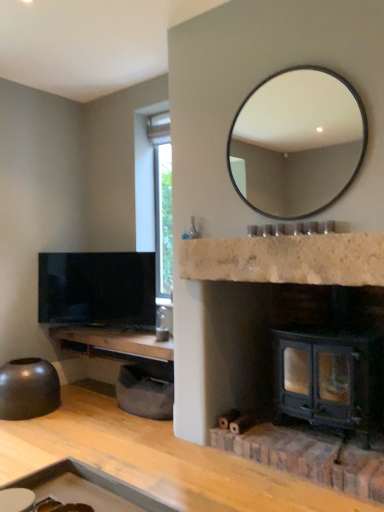
Describe the element at coordinates (329, 380) in the screenshot. I see `dark green metal wood burning stove at lower right` at that location.

Image resolution: width=384 pixels, height=512 pixels. In order to click on white marble fireplace at center, the second counter top from the bottom in this screenshot , I will do `click(287, 259)`.

Find the location of a particular element. woodenmaterial/texturecounter top at left, acting as the 1th counter top starting from the back is located at coordinates (113, 343).

Identify the location of matte black bowl at lower left. This screenshot has height=512, width=384. (28, 389).

The height and width of the screenshot is (512, 384). Identify the location of dark green metal wood burning stove at lower right. (329, 380).

Which object is further away from the camera taking this photo, dark green metal wood burning stove at lower right or white marble fireplace at center, the second counter top from the bottom?

dark green metal wood burning stove at lower right is more distant.

Is dark green metal wood burning stove at lower right facing towards white marble fireplace at center, the first counter top in the top-to-bottom sequence?

No.

From the picture: Which is more to the left, dark green metal wood burning stove at lower right or white marble fireplace at center, the second counter top from the bottom?

white marble fireplace at center, the second counter top from the bottom, is more to the left.

In the scene shown: Is dark green metal wood burning stove at lower right beside white marble fireplace at center, marked as the 2th counter top in a back-to-front arrangement?

There is a gap between dark green metal wood burning stove at lower right and white marble fireplace at center, marked as the 2th counter top in a back-to-front arrangement.

From a real-world perspective, relative to white marble fireplace at center, the first counter top in the top-to-bottom sequence, is matte black tv at left vertically above or below?

Clearly, from a real-world perspective, matte black tv at left is below white marble fireplace at center, the first counter top in the top-to-bottom sequence.

Is matte black tv at left at the left side of white marble fireplace at center, positioned as the 2th counter top in left-to-right order?

Yes.

Can you confirm if matte black tv at left is bigger than white marble fireplace at center, the second counter top from the bottom?

Indeed, matte black tv at left has a larger size compared to white marble fireplace at center, the second counter top from the bottom.

Choose the correct answer: Is matte black tv at left inside white marble fireplace at center, the first counter top in the top-to-bottom sequence, or outside it?

matte black tv at left cannot be found inside white marble fireplace at center, the first counter top in the top-to-bottom sequence.

Is matte black mirror at upper center not within dark green metal wood burning stove at lower right?

Yes, matte black mirror at upper center is not within dark green metal wood burning stove at lower right.

Is matte black mirror at upper center oriented away from dark green metal wood burning stove at lower right?

No, matte black mirror at upper center is not facing away from dark green metal wood burning stove at lower right.

In order to click on mirror in front of the dark green metal wood burning stove at lower right in this screenshot , I will do `click(297, 143)`.

From the image's perspective, is matte black mirror at upper center located above or below dark green metal wood burning stove at lower right?

→ From the image's perspective, matte black mirror at upper center appears above dark green metal wood burning stove at lower right.

Is white marble fireplace at center, the first counter top in the top-to-bottom sequence, next to matte black bowl at lower left?

white marble fireplace at center, the first counter top in the top-to-bottom sequence, and matte black bowl at lower left are clearly separated.

There is a matte black bowl at lower left. Identify the location of the 2nd counter top above it (from the image's perspective). This screenshot has width=384, height=512. (287, 259).

Considering the relative sizes of white marble fireplace at center, the first counter top in the top-to-bottom sequence, and matte black bowl at lower left in the image provided, is white marble fireplace at center, the first counter top in the top-to-bottom sequence, bigger than matte black bowl at lower left?

No, white marble fireplace at center, the first counter top in the top-to-bottom sequence, is not bigger than matte black bowl at lower left.

Is white marble fireplace at center, positioned as the 1th counter top in right-to-left order, shorter than matte black bowl at lower left?

Indeed, white marble fireplace at center, positioned as the 1th counter top in right-to-left order, has a lesser height compared to matte black bowl at lower left.

Between woodenmaterial/texturecounter top at left, the first counter top positioned from the bottom, and white marble fireplace at center, marked as the 2th counter top in a back-to-front arrangement, which one is positioned in front?

white marble fireplace at center, marked as the 2th counter top in a back-to-front arrangement, is in front.

Is woodenmaterial/texturecounter top at left, acting as the 1th counter top starting from the back, placed right next to white marble fireplace at center, arranged as the first counter top when viewed from the front?

woodenmaterial/texturecounter top at left, acting as the 1th counter top starting from the back, and white marble fireplace at center, arranged as the first counter top when viewed from the front, are clearly separated.

Is point (92, 337) less distant than point (248, 250)?

No.

From the picture: Measure the distance from woodenmaterial/texturecounter top at left, placed as the 2th counter top when sorted from front to back, to white marble fireplace at center, the second counter top from the bottom.

woodenmaterial/texturecounter top at left, placed as the 2th counter top when sorted from front to back, and white marble fireplace at center, the second counter top from the bottom, are 1.16 meters apart.

From a real-world perspective, relative to matte black tv at left, is white marble fireplace at center, the first counter top in the top-to-bottom sequence, vertically above or below?

white marble fireplace at center, the first counter top in the top-to-bottom sequence, is situated higher than matte black tv at left in the real world.

Is matte black tv at left at the back of white marble fireplace at center, arranged as the first counter top when viewed from the front?

No, white marble fireplace at center, arranged as the first counter top when viewed from the front, is not facing the opposite direction of matte black tv at left.

Considering the positions of points (242, 278) and (77, 285), is point (242, 278) farther from camera compared to point (77, 285)?

No, it is in front of (77, 285).

From the image's perspective, is white marble fireplace at center, the first counter top in the top-to-bottom sequence, below matte black tv at left?

Incorrect, from the image's perspective, white marble fireplace at center, the first counter top in the top-to-bottom sequence, is higher than matte black tv at left.

Is dark green metal wood burning stove at lower right aimed at woodenmaterial/texturecounter top at left, placed as the 2th counter top when sorted from front to back?

No, dark green metal wood burning stove at lower right is not oriented towards woodenmaterial/texturecounter top at left, placed as the 2th counter top when sorted from front to back.

Which is correct: dark green metal wood burning stove at lower right is inside woodenmaterial/texturecounter top at left, the first counter top from the left, or outside of it?

dark green metal wood burning stove at lower right is not enclosed by woodenmaterial/texturecounter top at left, the first counter top from the left.

In the image, is dark green metal wood burning stove at lower right positioned in front of or behind woodenmaterial/texturecounter top at left, placed as the 2th counter top when sorted from front to back?

Visually, dark green metal wood burning stove at lower right is located in front of woodenmaterial/texturecounter top at left, placed as the 2th counter top when sorted from front to back.

Identify the location of wood burning stove located underneath the white marble fireplace at center, the second counter top from the bottom (from a real-world perspective). (329, 380).

Where is `the 2nd counter top counting from the right side of the matte black tv at left`? This screenshot has height=512, width=384. the 2nd counter top counting from the right side of the matte black tv at left is located at coordinates (287, 259).

Estimate the real-world distances between objects in this image. Which object is further from matte black mirror at upper center, matte black bowl at lower left or white marble fireplace at center, arranged as the first counter top when viewed from the front?

Based on the image, matte black bowl at lower left appears to be further to matte black mirror at upper center.

Estimate the real-world distances between objects in this image. Which object is further from matte black bowl at lower left, matte black mirror at upper center or dark green metal wood burning stove at lower right?

matte black mirror at upper center is positioned further to the anchor matte black bowl at lower left.

Looking at the image, which one is located closer to dark green metal wood burning stove at lower right, woodenmaterial/texturecounter top at left, acting as the 1th counter top starting from the back, or matte black tv at left?

woodenmaterial/texturecounter top at left, acting as the 1th counter top starting from the back, lies closer to dark green metal wood burning stove at lower right than the other object.

From the image, which object appears to be nearer to matte black mirror at upper center, white marble fireplace at center, positioned as the 2th counter top in left-to-right order, or matte black tv at left?

matte black tv at left lies closer to matte black mirror at upper center than the other object.

From the image, which object appears to be nearer to white marble fireplace at center, positioned as the 2th counter top in left-to-right order, woodenmaterial/texturecounter top at left, which is the 2th counter top from top to bottom, or matte black bowl at lower left?

woodenmaterial/texturecounter top at left, which is the 2th counter top from top to bottom, lies closer to white marble fireplace at center, positioned as the 2th counter top in left-to-right order, than the other object.

Estimate the real-world distances between objects in this image. Which object is closer to matte black mirror at upper center, dark green metal wood burning stove at lower right or matte black bowl at lower left?

dark green metal wood burning stove at lower right is positioned closer to the anchor matte black mirror at upper center.

When comparing their distances from woodenmaterial/texturecounter top at left, the first counter top from the left, does matte black mirror at upper center or matte black bowl at lower left seem closer?

Based on the image, matte black bowl at lower left appears to be nearer to woodenmaterial/texturecounter top at left, the first counter top from the left.

From the image, which object appears to be farther from woodenmaterial/texturecounter top at left, the first counter top from the left, matte black tv at left or dark green metal wood burning stove at lower right?

Among the two, dark green metal wood burning stove at lower right is located further to woodenmaterial/texturecounter top at left, the first counter top from the left.

At what (x,y) coordinates should I click in order to perform the action: click on counter top between matte black mirror at upper center and matte black tv at left in the front-back direction. Please return your answer as a coordinate pair (x, y). This screenshot has width=384, height=512. Looking at the image, I should click on (113, 343).

Locate an element on the screen. counter top between matte black mirror at upper center and woodenmaterial/texturecounter top at left, the first counter top positioned from the bottom, in the vertical direction is located at coordinates (287, 259).

Identify the location of television between matte black bowl at lower left and matte black mirror at upper center in the horizontal direction. The height and width of the screenshot is (512, 384). (97, 289).

The image size is (384, 512). In order to click on mirror between woodenmaterial/texturecounter top at left, which is the 2th counter top from top to bottom, and dark green metal wood burning stove at lower right, in the horizontal direction in this screenshot , I will do `click(297, 143)`.